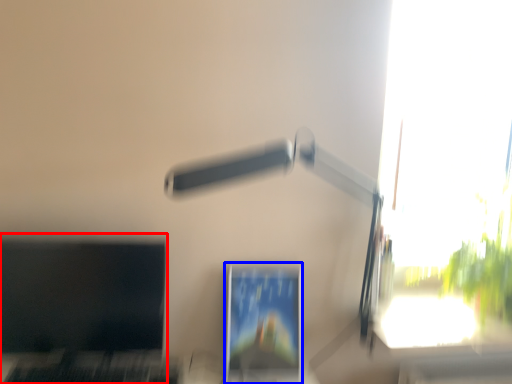
Question: Which object is closer to the camera taking this photo, computer monitor (highlighted by a red box) or computer monitor (highlighted by a blue box)?

Choices:
 (A) computer monitor
 (B) computer monitor

Answer: (A)